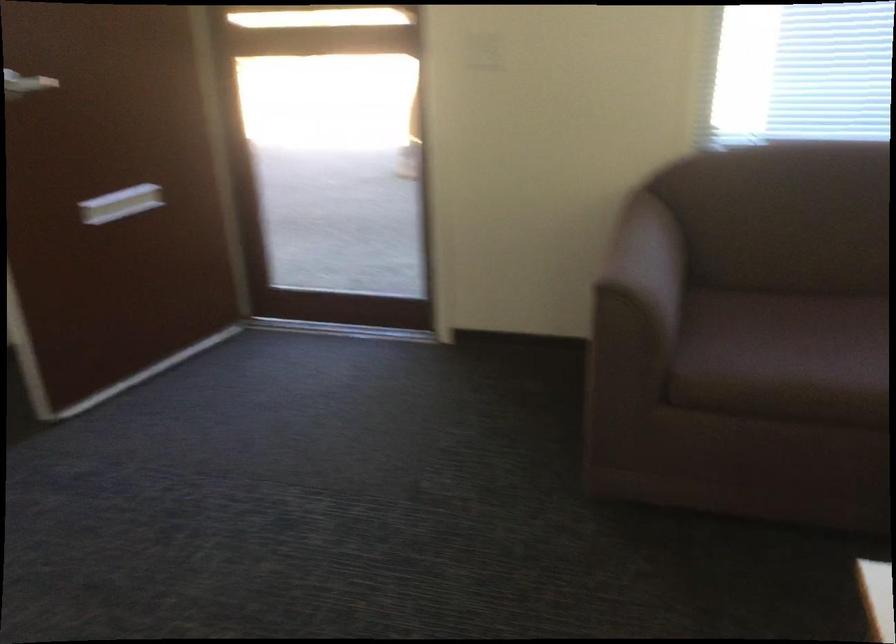
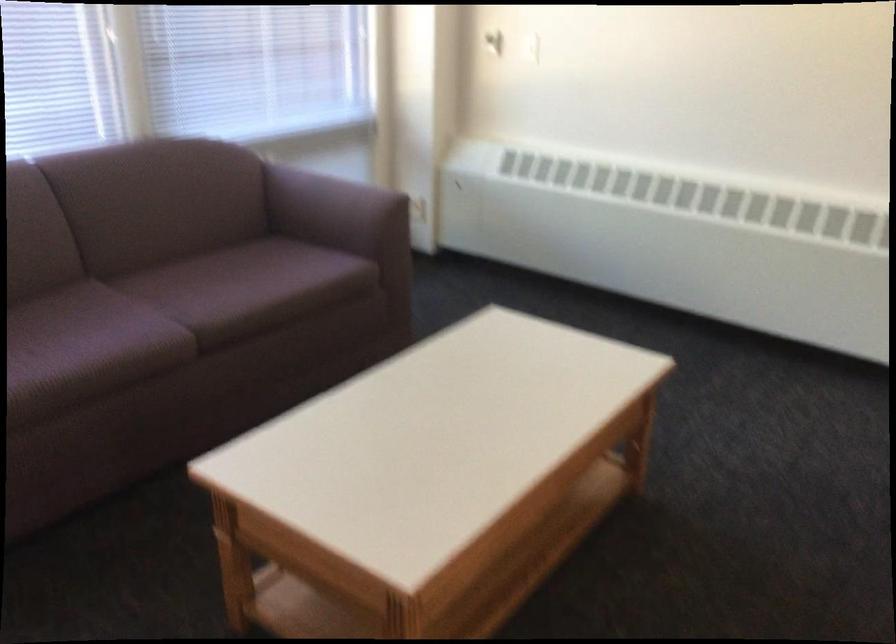
Question: The camera is either moving clockwise (left) or counter-clockwise (right) around the object. The first image is from the beginning of the video and the second image is from the end. Is the camera moving left or right when shooting the video?

Choices:
 (A) Left
 (B) Right

Answer: (A)